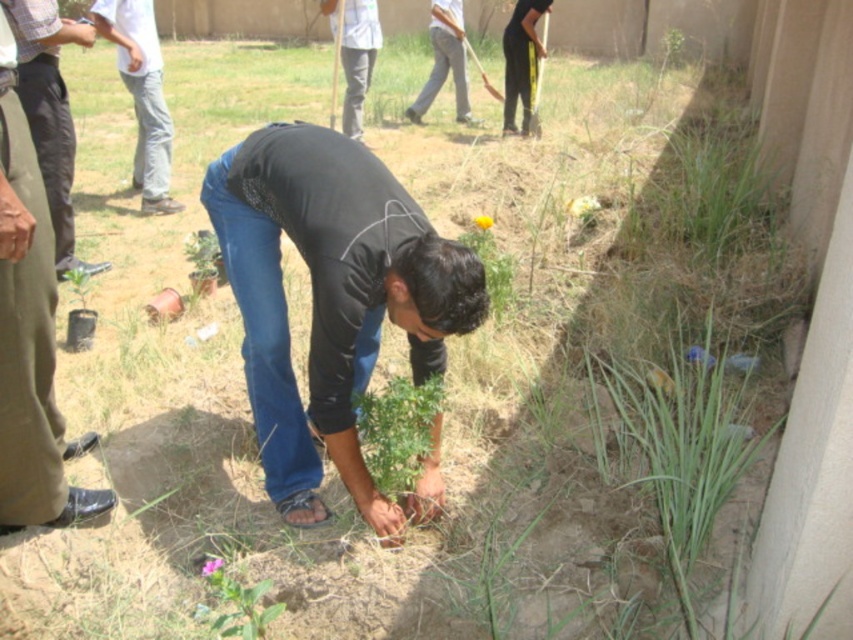
You are standing at the point marked by the coordinates point (50,112) in the image. What object is located exactly at this point?

The point (50,112) marks brown cotton pants at lower left.

You are a photographer taking a picture of the gardening scene. You need to ensure that both the brown cotton pants at lower left and the light gray jeans at upper left are visible in the frame. Which of the two should you focus on to ensure the taller one is properly captured?

The light gray jeans at upper left is taller than the brown cotton pants at lower left, so you should focus on the light gray jeans at upper left to ensure the taller one is properly captured.